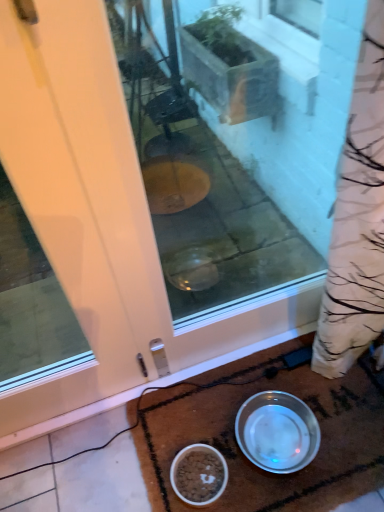
Question: Looking at their shapes, would you say white glossy bowl at lower center, which is the 1th bowl in left-to-right order, is wider or thinner than silver metallic bowl at lower center, which ranks as the 2th bowl in left-to-right order?

Choices:
 (A) wide
 (B) thin

Answer: (B)

Question: From the image's perspective, relative to silver metallic bowl at lower center, which ranks as the 2th bowl in left-to-right order, is white glossy bowl at lower center, the second bowl from the right, above or below?

Choices:
 (A) above
 (B) below

Answer: (B)

Question: Which of these objects is positioned closest to the silver metallic bowl at lower center, arranged as the 1th bowl when viewed from the right?

Choices:
 (A) white glossy bowl at lower center, which is the 1th bowl in left-to-right order
 (B) brown textured doormat at lower center
 (C) white glossy door at center

Answer: (B)

Question: Which is nearer to the silver metallic bowl at lower center, arranged as the 1th bowl when viewed from the right?

Choices:
 (A) white glossy door at center
 (B) brown textured doormat at lower center
 (C) white glossy bowl at lower center, the second bowl from the right

Answer: (B)